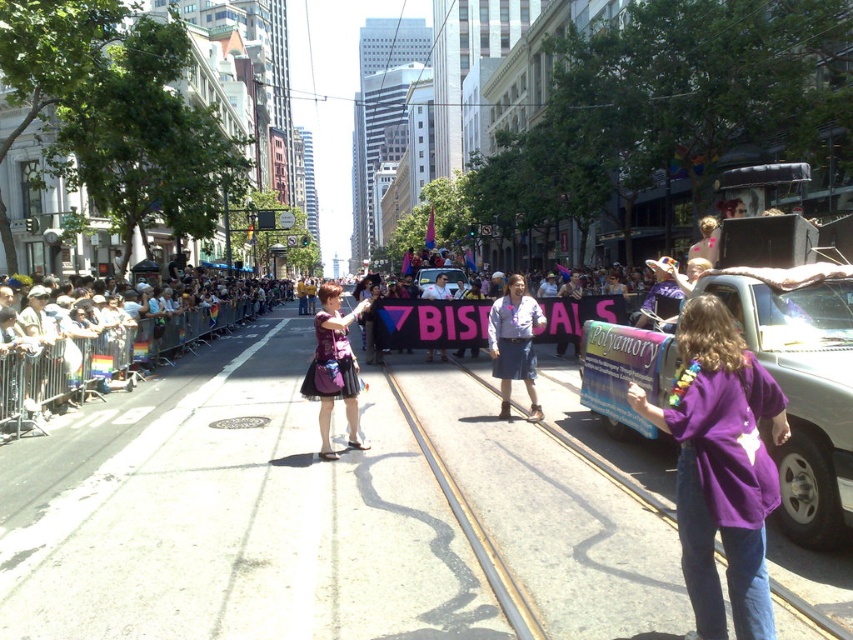
Between purple fabric dress at center and denim skirt at center, which one is positioned higher?

Positioned higher is purple fabric dress at center.

Consider the image. Who is more forward, (337, 291) or (508, 356)?

Point (337, 291) is more forward.

Locate an element on the screen. purple fabric dress at center is located at coordinates (334, 368).

Is denim skirt at center shorter than purple fabric skirt at center?

In fact, denim skirt at center may be taller than purple fabric skirt at center.

Is point (492, 326) in front of point (440, 276)?

That is True.

In order to click on denim skirt at center in this screenshot , I will do `click(514, 342)`.

Is purple cotton shirt at center above denim skirt at center?

Actually, purple cotton shirt at center is below denim skirt at center.

Describe the element at coordinates (721, 467) in the screenshot. I see `purple cotton shirt at center` at that location.

Is point (717, 468) less distant than point (534, 316)?

Yes, point (717, 468) is closer to viewer.

Find the location of a particular element. purple cotton shirt at center is located at coordinates (721, 467).